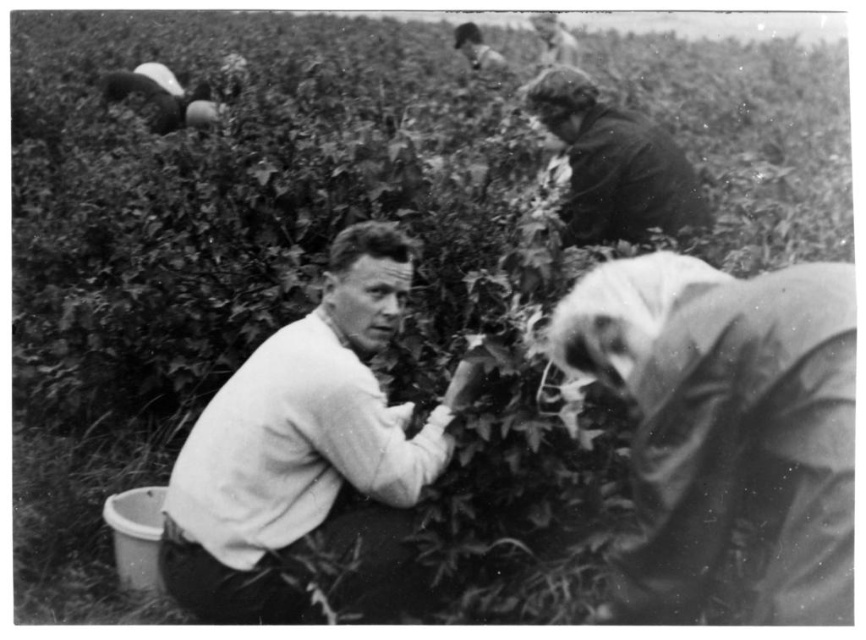
Question: Is white matte shirt at center bigger than smooth skin face at upper center?

Choices:
 (A) no
 (B) yes

Answer: (A)

Question: Which is farther from the dark gray fabric at lower right?

Choices:
 (A) smooth fabric shirt at upper center
 (B) dark brown fabric at upper right
 (C) smooth skin face at upper center

Answer: (A)

Question: Which point is farther to the camera?

Choices:
 (A) (260, 444)
 (B) (570, 54)
 (C) (587, 362)
 (D) (662, 134)

Answer: (B)

Question: From the image, what is the correct spatial relationship of dark brown fabric at upper right in relation to smooth skin face at upper center?

Choices:
 (A) left
 (B) right

Answer: (B)

Question: Is dark brown fabric at upper right further to the viewer compared to smooth skin face at upper center?

Choices:
 (A) no
 (B) yes

Answer: (A)

Question: Which point is farther from the camera taking this photo?

Choices:
 (A) (556, 54)
 (B) (437, 404)
 (C) (598, 221)
 (D) (463, 24)

Answer: (D)